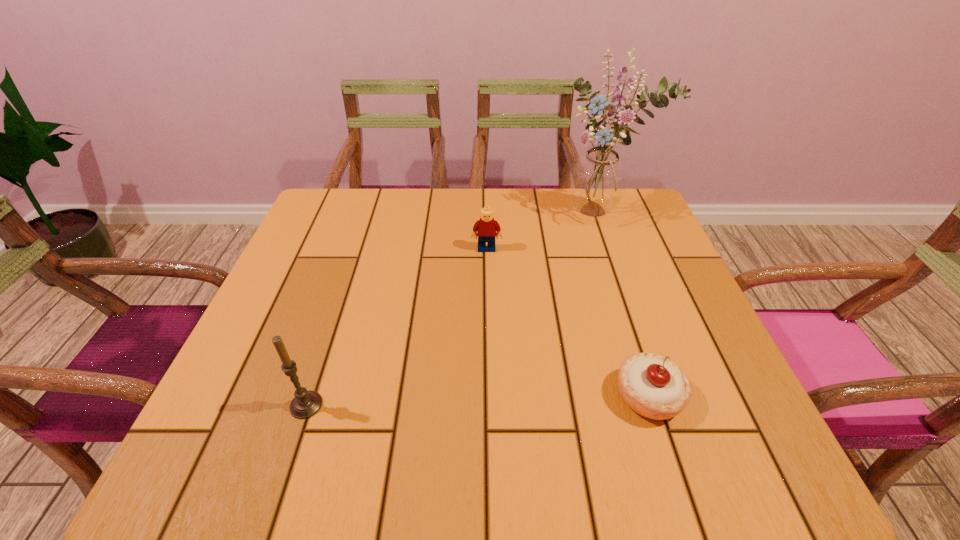
The width and height of the screenshot is (960, 540). What are the coordinates of `blank region between the tallest object and the third nearest object` in the screenshot? It's located at (543, 230).

This screenshot has width=960, height=540. In order to click on free space between the farthest object and the leftmost object in this screenshot , I will do `click(453, 307)`.

In order to click on unoccupied position between the bouquet and the leftmost object in this screenshot , I will do point(453,307).

This screenshot has height=540, width=960. Identify the location of unoccupied area between the leftmost object and the farthest object. (453, 307).

Locate an element on the screen. The image size is (960, 540). unoccupied position between the Lego and the leftmost object is located at coordinates (396, 327).

You are a GUI agent. You are given a task and a screenshot of the screen. Output one action in this format:
    pyautogui.click(x=<x>, y=<y>)
    Task: Click on the vacant point located between the third shortest object and the second shortest object
    
    Given the screenshot: What is the action you would take?
    pyautogui.click(x=396, y=327)

I want to click on free space between the pastry and the second object from left to right, so click(567, 322).

Where is `free point between the pastry and the candle`? free point between the pastry and the candle is located at coordinates (478, 400).

This screenshot has width=960, height=540. Identify the location of free space between the third shortest object and the second shortest object. (396, 327).

This screenshot has width=960, height=540. What are the coordinates of `the closest object relative to the bouquet` in the screenshot? It's located at (485, 228).